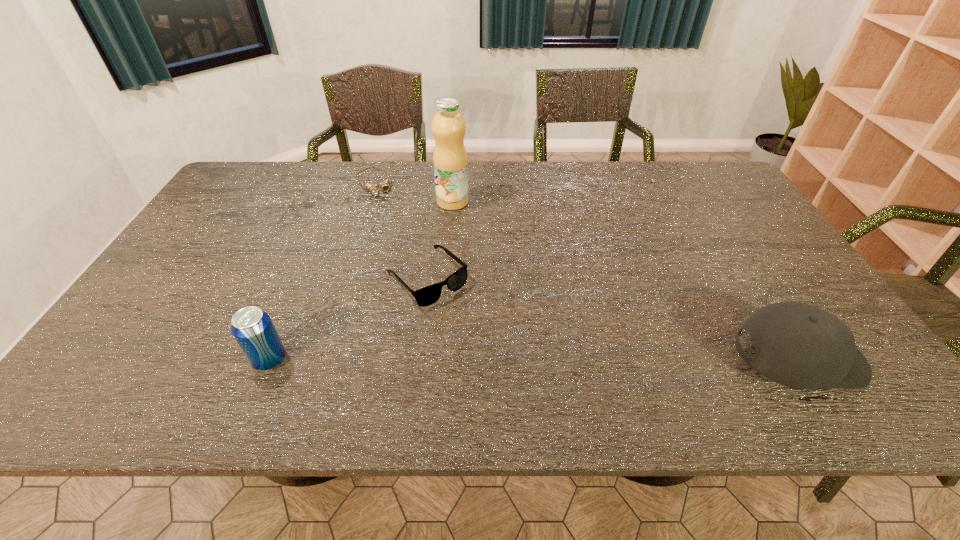
This screenshot has height=540, width=960. I want to click on vacant spot on the desktop that is between the beer can and the baseball cap and is positioned on the front-facing side of the second shortest object, so click(511, 360).

This screenshot has width=960, height=540. I want to click on free space on the desktop that is between the leftmost object and the rightmost object and is positioned on the front lenses and sides of the goggles, so click(x=468, y=360).

Where is `vacant space on the desktop that is between the beer can and the rightmost object and is positioned on the front label of the tallest object`? vacant space on the desktop that is between the beer can and the rightmost object and is positioned on the front label of the tallest object is located at coordinates (593, 360).